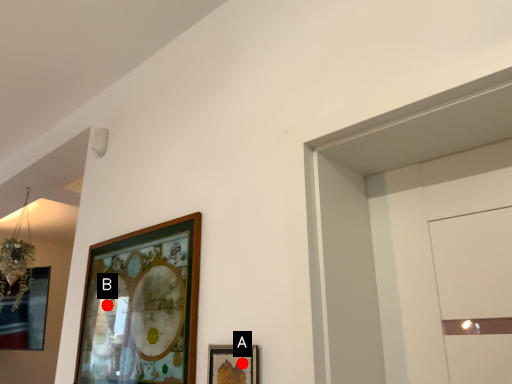
Question: Two points are circled on the image, labeled by A and B beside each circle. Which point appears farthest from the camera in this image?

Choices:
 (A) A is further
 (B) B is further

Answer: (B)